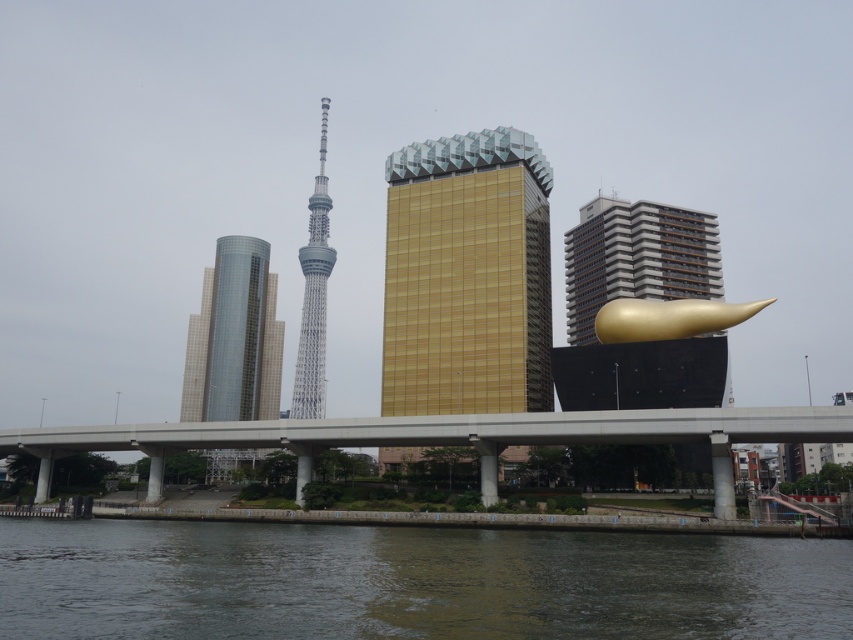
In the scene shown: You are a city planner analyzing the urban layout. The point marked at coordinates (447, 436) is part of which structure in the image?

The point marked at coordinates (447, 436) indicates the concrete bridge at center.

You are standing at the edge of the dark gray water at lower center and want to take a photo of the white glass tower at center. Which object is closer to you when you point your camera upwards?

The dark gray water at lower center is closer to you than the white glass tower at center, so when you point your camera upwards, the white glass tower at center will be the one in focus since it is further away and the water is in the foreground.